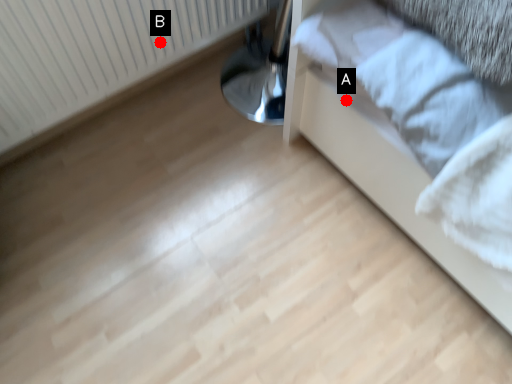
Question: Two points are circled on the image, labeled by A and B beside each circle. Which point appears closest to the camera in this image?

Choices:
 (A) A is closer
 (B) B is closer

Answer: (A)